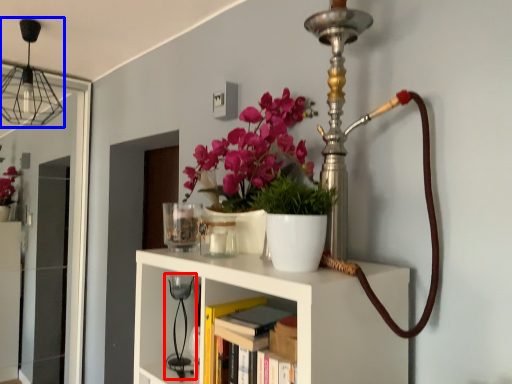
Question: Which object is further to the camera taking this photo, table lamp (highlighted by a red box) or lamp (highlighted by a blue box)?

Choices:
 (A) table lamp
 (B) lamp

Answer: (B)